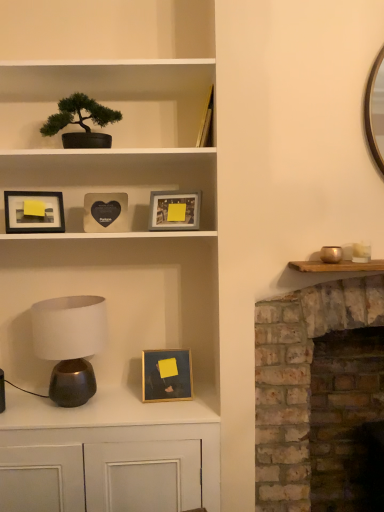
At what (x,y) coordinates should I click in order to perform the action: click on empty space that is ontop of matte black bonsai tree at upper left (from a real-world perspective). Please return your answer as a coordinate pair (x, y). The width and height of the screenshot is (384, 512). Looking at the image, I should click on (87, 76).